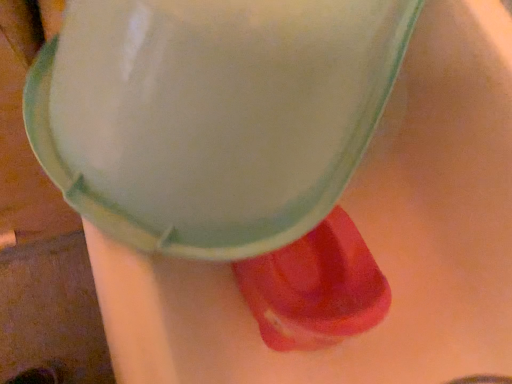
Question: Is matte white foam at center spatially inside rubberized red shoe at lower right, or outside of it?

Choices:
 (A) outside
 (B) inside

Answer: (A)

Question: Considering the positions of matte white foam at center and rubberized red shoe at lower right in the image, is matte white foam at center bigger or smaller than rubberized red shoe at lower right?

Choices:
 (A) big
 (B) small

Answer: (A)

Question: Considering the relative positions of matte white foam at center and rubberized red shoe at lower right in the image provided, is matte white foam at center to the left or to the right of rubberized red shoe at lower right?

Choices:
 (A) left
 (B) right

Answer: (A)

Question: Is rubberized red shoe at lower right situated inside matte white foam at center or outside?

Choices:
 (A) inside
 (B) outside

Answer: (B)

Question: Is rubberized red shoe at lower right in front of or behind matte white foam at center in the image?

Choices:
 (A) behind
 (B) front

Answer: (A)

Question: In the image, is rubberized red shoe at lower right on the left side or the right side of matte white foam at center?

Choices:
 (A) right
 (B) left

Answer: (A)

Question: Looking at the image, does rubberized red shoe at lower right seem bigger or smaller compared to matte white foam at center?

Choices:
 (A) big
 (B) small

Answer: (B)